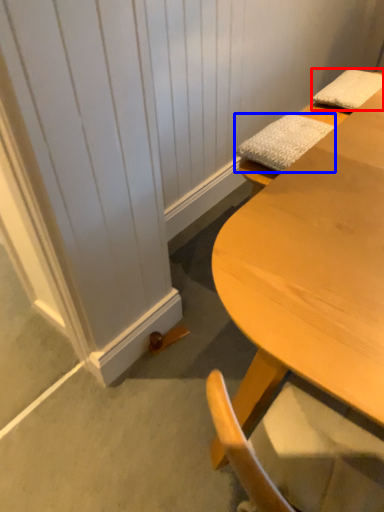
Question: Among these objects, which one is farthest to the camera, pillow (highlighted by a red box) or pillow (highlighted by a blue box)?

Choices:
 (A) pillow
 (B) pillow

Answer: (A)